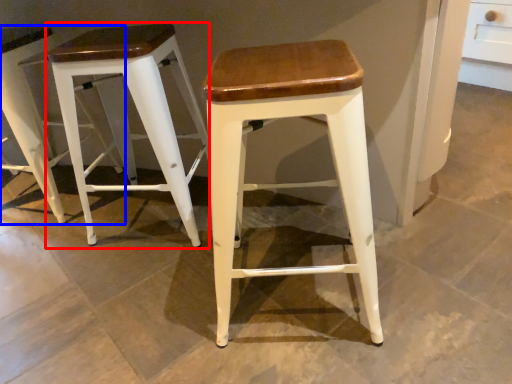
Question: Which object is closer to the camera taking this photo, stool (highlighted by a red box) or stool (highlighted by a blue box)?

Choices:
 (A) stool
 (B) stool

Answer: (A)